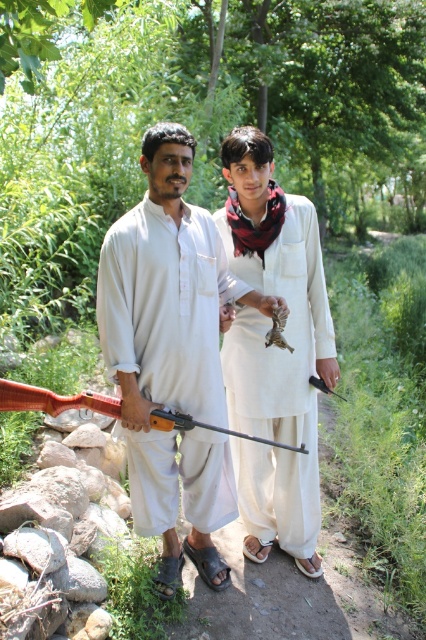
Question: Does matte white shirt at center appear over matte white robe at center?

Choices:
 (A) yes
 (B) no

Answer: (A)

Question: Which of the following is the farthest from the observer?

Choices:
 (A) wooden smooth shotgun at lower left
 (B) matte white shirt at center

Answer: (B)

Question: Which object is positioned closest to the white cotton robe at center?

Choices:
 (A) matte white shirt at center
 (B) wooden smooth shotgun at lower left
 (C) matte white robe at center

Answer: (A)

Question: Observing the image, what is the correct spatial positioning of matte white shirt at center in reference to wooden smooth shotgun at lower left?

Choices:
 (A) left
 (B) right

Answer: (B)

Question: Estimate the real-world distances between objects in this image. Which object is farther from the white cotton robe at center?

Choices:
 (A) wooden smooth shotgun at lower left
 (B) matte white robe at center

Answer: (A)

Question: Observing the image, what is the correct spatial positioning of matte white shirt at center in reference to wooden smooth shotgun at lower left?

Choices:
 (A) left
 (B) right

Answer: (B)